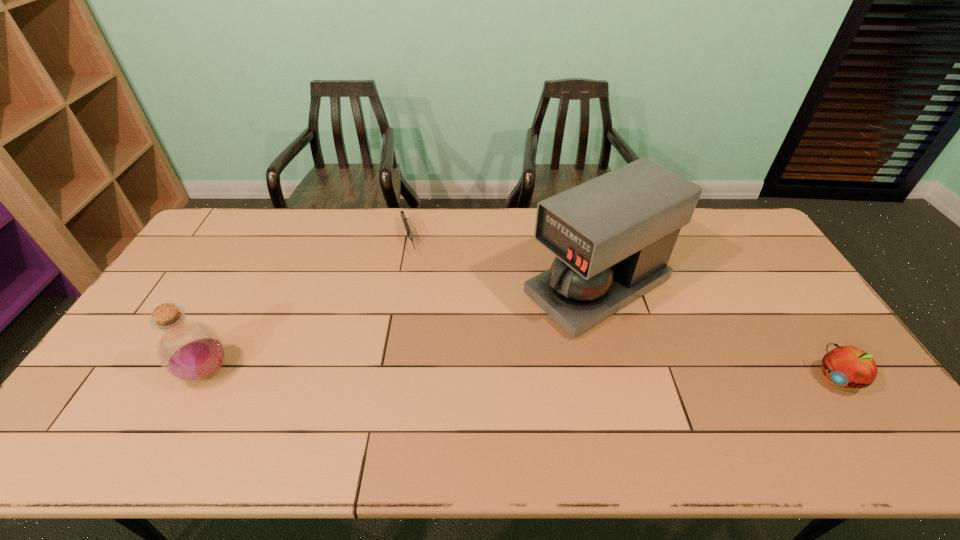
Locate an element on the screen. blank area located aimed along the barrel of the shortest object is located at coordinates (415, 275).

Locate an element on the screen. The width and height of the screenshot is (960, 540). free location located 0.230m aimed along the barrel of the shortest object is located at coordinates (425, 305).

I want to click on free space located aimed along the barrel of the shortest object, so click(432, 325).

Find the location of a particular element. The width and height of the screenshot is (960, 540). vacant space located 0.340m on the carafe side of the third object from left to right is located at coordinates (441, 374).

The image size is (960, 540). I want to click on free space located 0.270m on the carafe side of the third object from left to right, so click(463, 361).

This screenshot has width=960, height=540. I want to click on free point located 0.210m on the carafe side of the third object from left to right, so click(x=481, y=350).

Locate an element on the screen. The image size is (960, 540). gun that is at the far edge is located at coordinates (404, 219).

The height and width of the screenshot is (540, 960). I want to click on coffee maker present at the far edge, so click(x=612, y=236).

The height and width of the screenshot is (540, 960). What are the coordinates of `bottle that is positioned at the near edge` in the screenshot? It's located at (191, 351).

I want to click on apple that is at the near edge, so (845, 366).